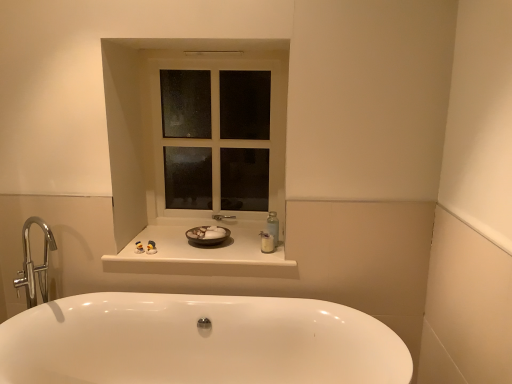
Question: Does translucent plastic bottle at center, the 1th toiletry in the right-to-left sequence, have a smaller size compared to white glass window at center?

Choices:
 (A) no
 (B) yes

Answer: (B)

Question: From the image's perspective, is translucent plastic bottle at center, the 1th toiletry in the right-to-left sequence, under white glass window at center?

Choices:
 (A) yes
 (B) no

Answer: (A)

Question: Does translucent plastic bottle at center, the 1th toiletry in the right-to-left sequence, contain white glass window at center?

Choices:
 (A) no
 (B) yes

Answer: (A)

Question: From a real-world perspective, is translucent plastic bottle at center, the 1th toiletry in the right-to-left sequence, located higher than white glass window at center?

Choices:
 (A) no
 (B) yes

Answer: (A)

Question: Is translucent plastic bottle at center, the 1th toiletry in the right-to-left sequence, outside white glass window at center?

Choices:
 (A) no
 (B) yes

Answer: (B)

Question: Considering the positions of point (x=142, y=251) and point (x=159, y=59), is point (x=142, y=251) closer or farther from the camera than point (x=159, y=59)?

Choices:
 (A) closer
 (B) farther

Answer: (A)

Question: From a real-world perspective, is white glossy toiletries at center, the 1th toiletry in the left-to-right sequence, positioned above or below white glass window at center?

Choices:
 (A) below
 (B) above

Answer: (A)

Question: Is white glossy toiletries at center, arranged as the 2th toiletry when viewed from the right, spatially inside white glass window at center, or outside of it?

Choices:
 (A) outside
 (B) inside

Answer: (A)

Question: From their relative heights in the image, would you say white glossy toiletries at center, the 1th toiletry in the left-to-right sequence, is taller or shorter than white glass window at center?

Choices:
 (A) short
 (B) tall

Answer: (A)

Question: In terms of width, does white glossy counter top at center look wider or thinner when compared to white glass window at center?

Choices:
 (A) wide
 (B) thin

Answer: (A)

Question: Is white glossy counter top at center bigger or smaller than white glass window at center?

Choices:
 (A) big
 (B) small

Answer: (B)

Question: Considering the positions of white glossy counter top at center and white glass window at center in the image, is white glossy counter top at center taller or shorter than white glass window at center?

Choices:
 (A) short
 (B) tall

Answer: (A)

Question: Would you say white glossy counter top at center is to the left or to the right of white glass window at center in the picture?

Choices:
 (A) right
 (B) left

Answer: (B)

Question: From a real-world perspective, relative to white glossy bathtub at lower center, is white glossy counter top at center vertically above or below?

Choices:
 (A) above
 (B) below

Answer: (A)

Question: Is white glossy counter top at center wider or thinner than white glossy bathtub at lower center?

Choices:
 (A) wide
 (B) thin

Answer: (B)